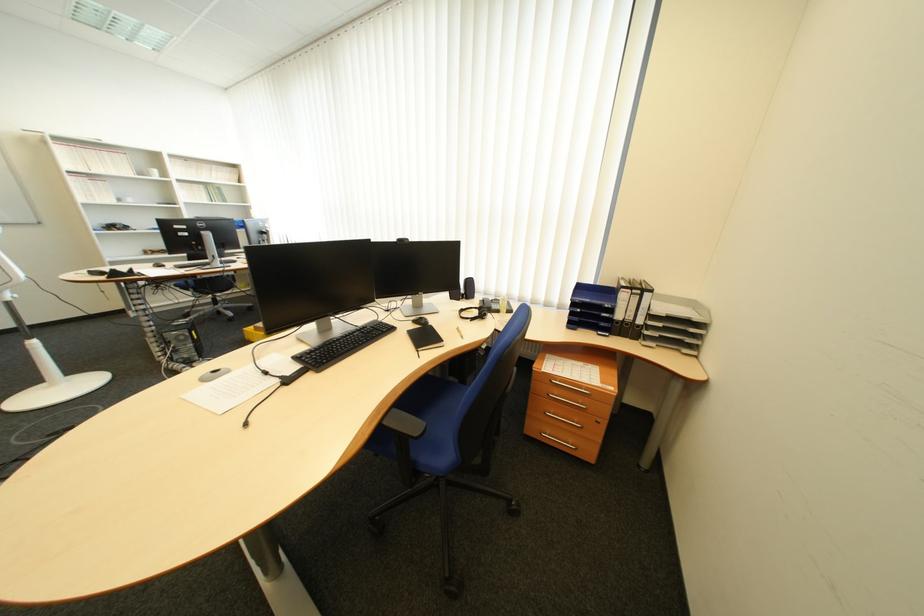
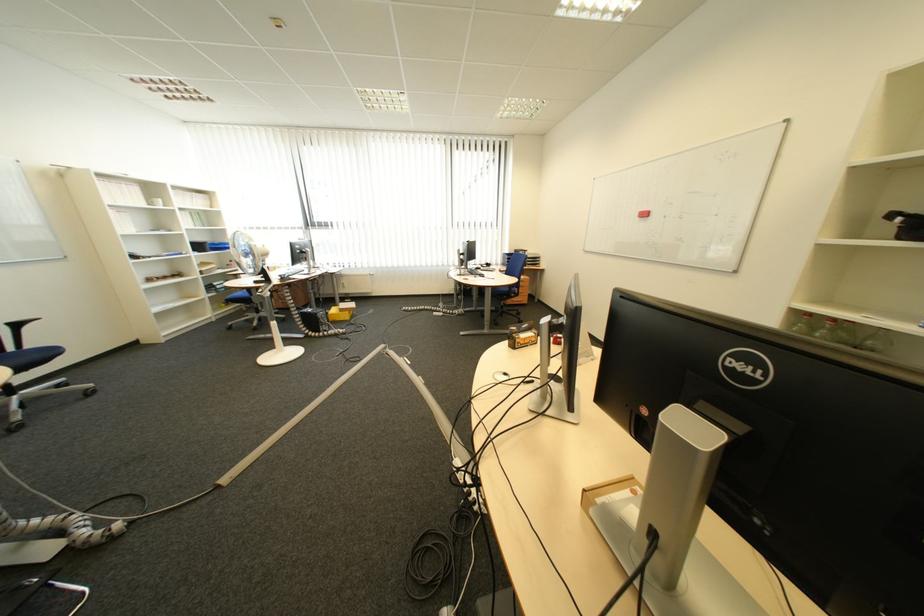
The point at (x=195, y=339) is marked in the first image. Where is the corresponding point in the second image?

(335, 317)